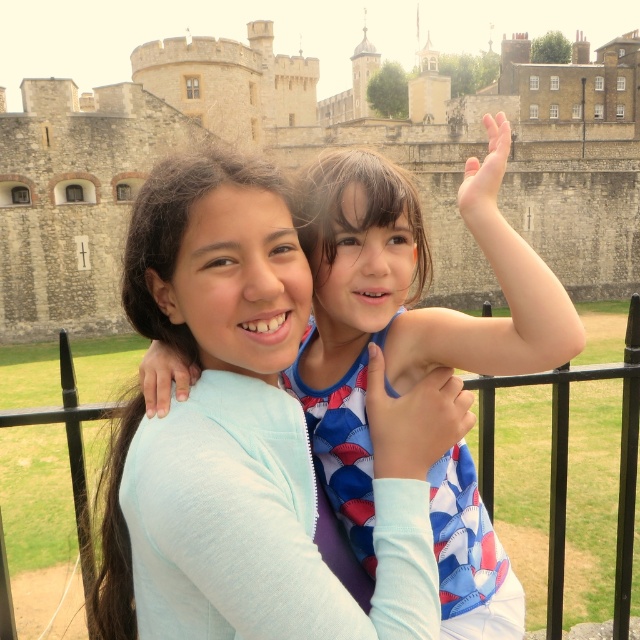
Is stone castle at center positioned behind light blue fabric shirt at center?

That is True.

Is point (486, 289) closer to viewer compared to point (433, 509)?

No.

Identify the location of stone castle at center. This screenshot has width=640, height=640. (312, 156).